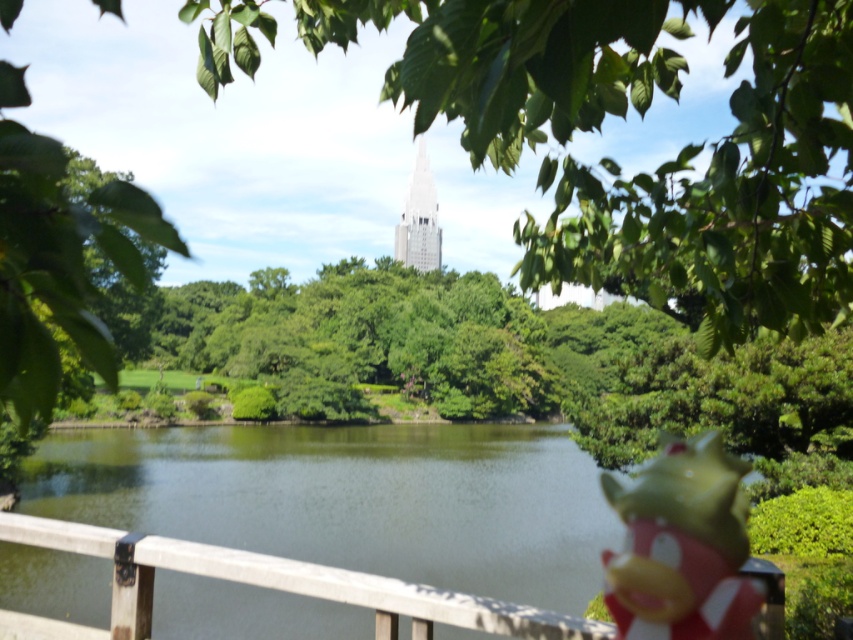
You are a photographer standing in the park and want to capture a photo that includes both the white wood rail at lower center and the white glass tower at center. Based on their sizes, which object should you position closer to the edge of the frame to ensure both are visible?

Since the white wood rail at lower center is smaller in size compared to the white glass tower at center, you should position the white wood rail at lower center closer to the edge of the frame to ensure both objects fit within the photo.

You are standing at the point with coordinates point (540, 464) and want to walk to the point with coordinates point (265, 564). According to the scene description, will your path be blocked by any objects?

Point (540, 464) is behind point (265, 564), so your path to point (265, 564) will not be blocked because you are already behind it.